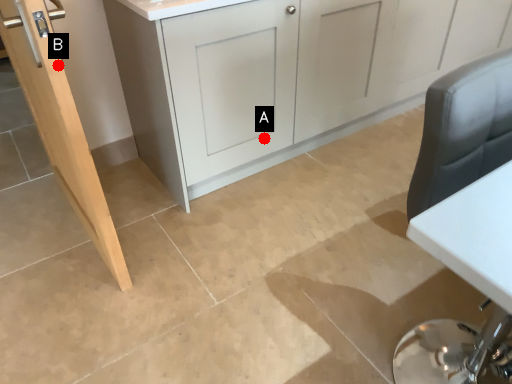
Question: Two points are circled on the image, labeled by A and B beside each circle. Which of the following is the farthest from the observer?

Choices:
 (A) A is further
 (B) B is further

Answer: (A)